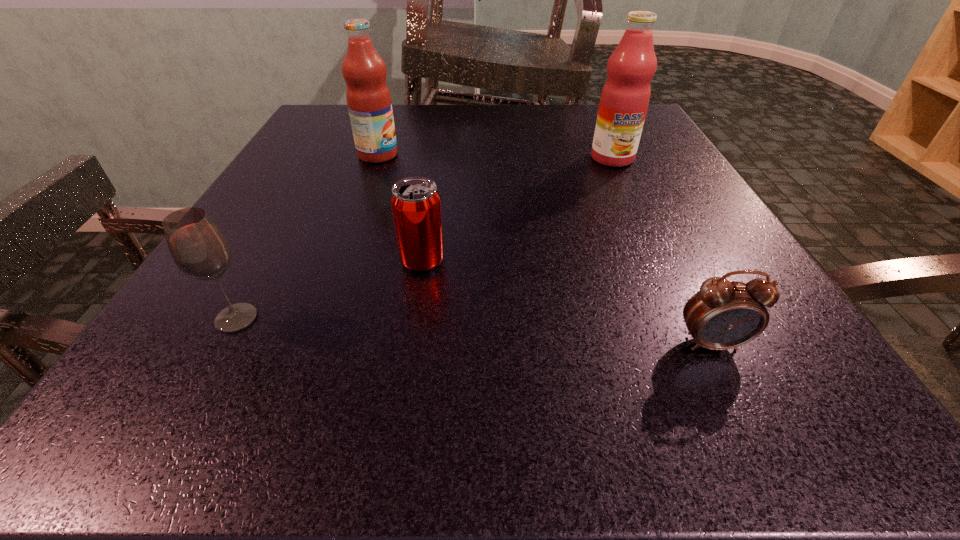
Find the location of a particular element. object that stands as the second closest to the right fruit juice is located at coordinates (368, 97).

Identify which object is the nearest to the left fruit juice. Please provide its 2D coordinates. Your answer should be formatted as a tuple, i.e. [(x, y)], where the tuple contains the x and y coordinates of a point satisfying the conditions above.

[(415, 202)]

Find the location of a particular element. The image size is (960, 540). blank space that satisfies the following two spatial constraints: 1. on the back side of the soda can; 2. on the front label of the second object from left to right is located at coordinates click(439, 155).

The width and height of the screenshot is (960, 540). Identify the location of blank space that satisfies the following two spatial constraints: 1. on the front label of the left fruit juice; 2. on the back side of the soda can. tap(339, 261).

Where is `vacant space that satisfies the following two spatial constraints: 1. on the front label of the third farthest object; 2. on the right side of the fourth object from right to left`? This screenshot has width=960, height=540. vacant space that satisfies the following two spatial constraints: 1. on the front label of the third farthest object; 2. on the right side of the fourth object from right to left is located at coordinates (339, 261).